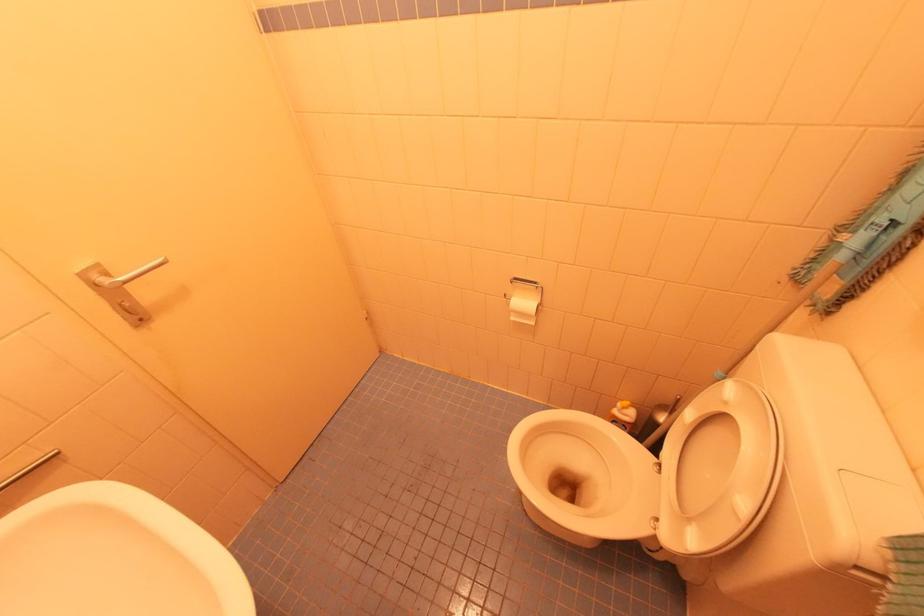
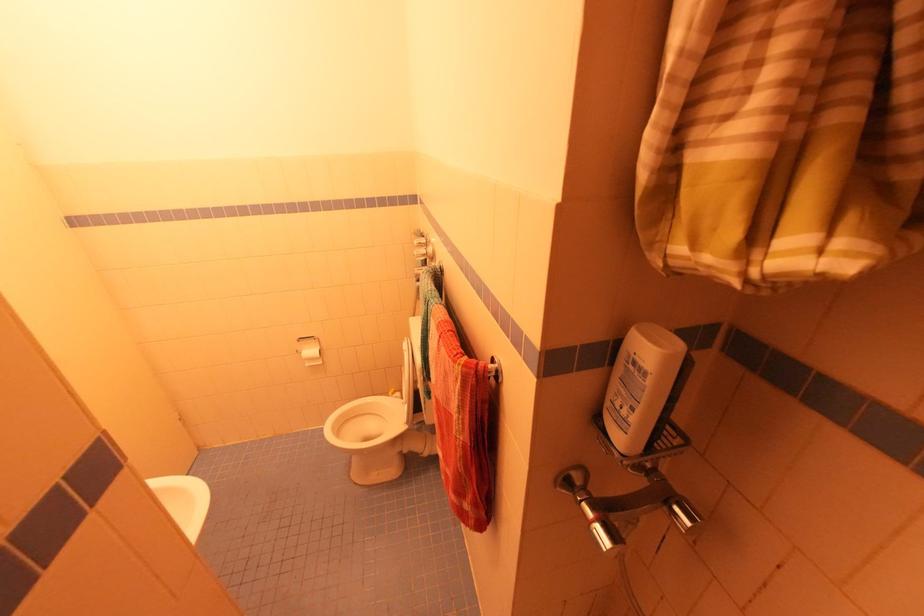
Question: Based on the continuous images, in which direction is the camera rotating? Reply with the corresponding letter.

Choices:
 (A) Left
 (B) Right
 (C) Up
 (D) Down

Answer: (B)